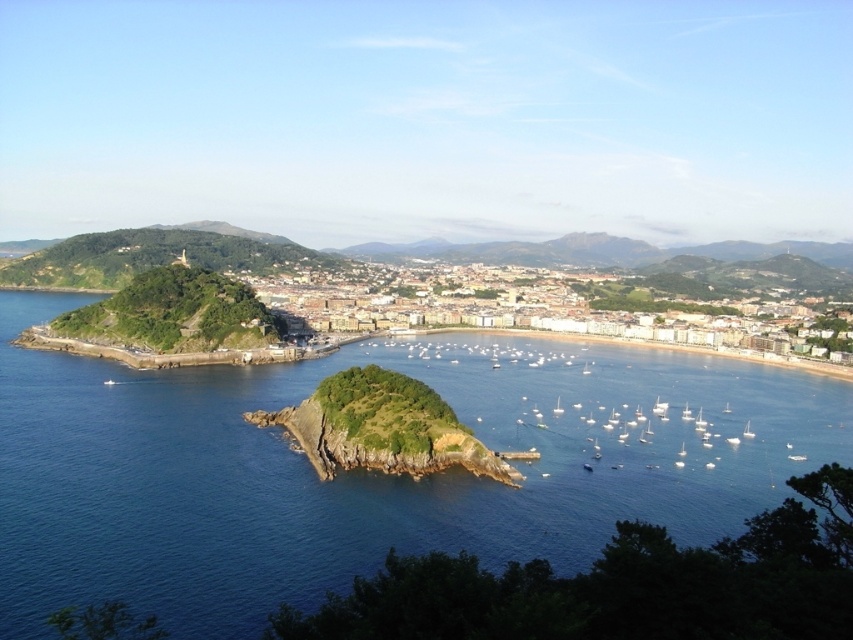
Question: Which object appears closest to the camera in this image?

Choices:
 (A) green grassy hillside at center
 (B) blue water at center

Answer: (B)

Question: Is blue water at center to the left of green grassy hillside at center from the viewer's perspective?

Choices:
 (A) yes
 (B) no

Answer: (A)

Question: In this image, where is blue water at center located relative to green grassy hillside at center?

Choices:
 (A) left
 (B) right

Answer: (A)

Question: Does blue water at center have a lesser width compared to green grassy hillside at center?

Choices:
 (A) no
 (B) yes

Answer: (B)

Question: Among these points, which one is nearest to the camera?

Choices:
 (A) (813, 285)
 (B) (590, 515)

Answer: (B)